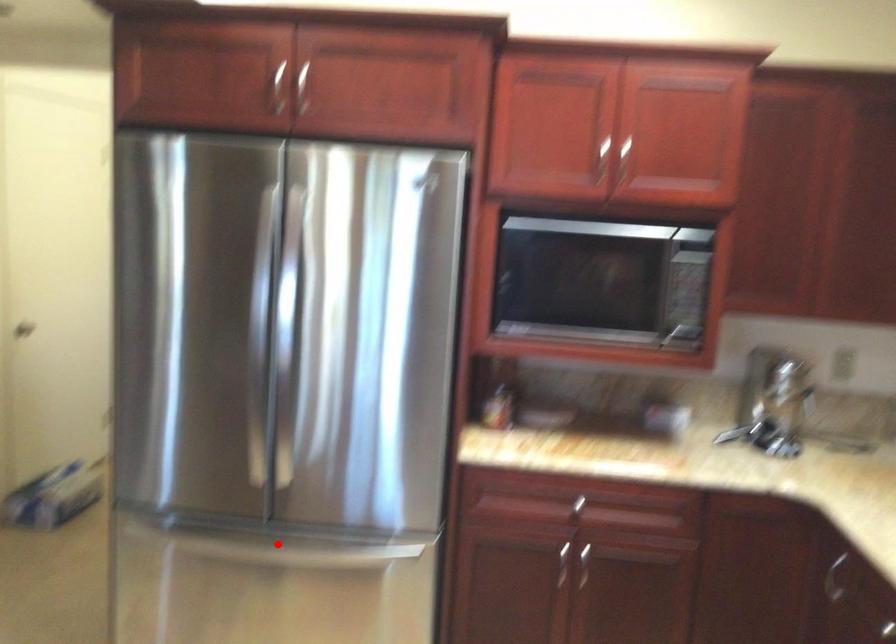
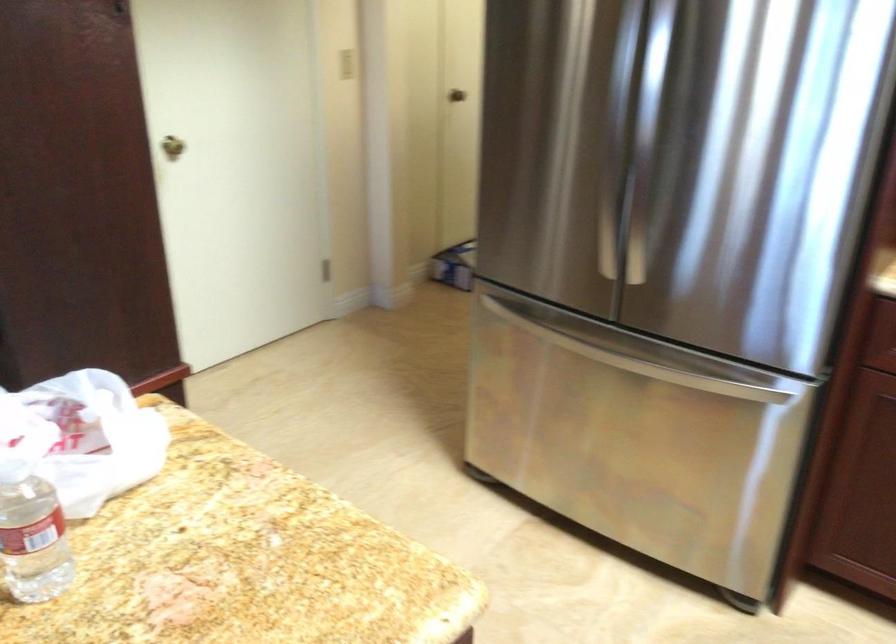
Question: A red point is marked in image1. In image2, is the corresponding 3D point closer to the camera or farther? Reply with the corresponding letter.

Choices:
 (A) The corresponding 3D point is closer.
 (B) The corresponding 3D point is farther.

Answer: (A)